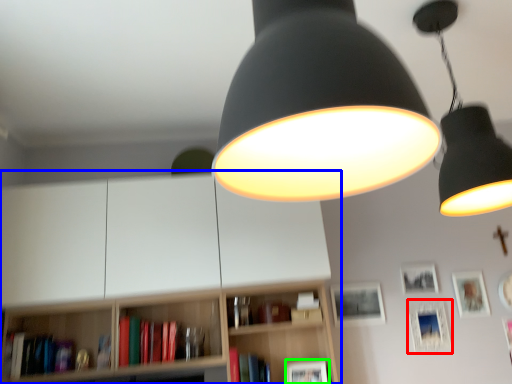
Question: Considering the real-world distances, which object is farthest from picture frame (highlighted by a red box)? bookcase (highlighted by a blue box) or picture frame (highlighted by a green box)?

Choices:
 (A) bookcase
 (B) picture frame

Answer: (A)